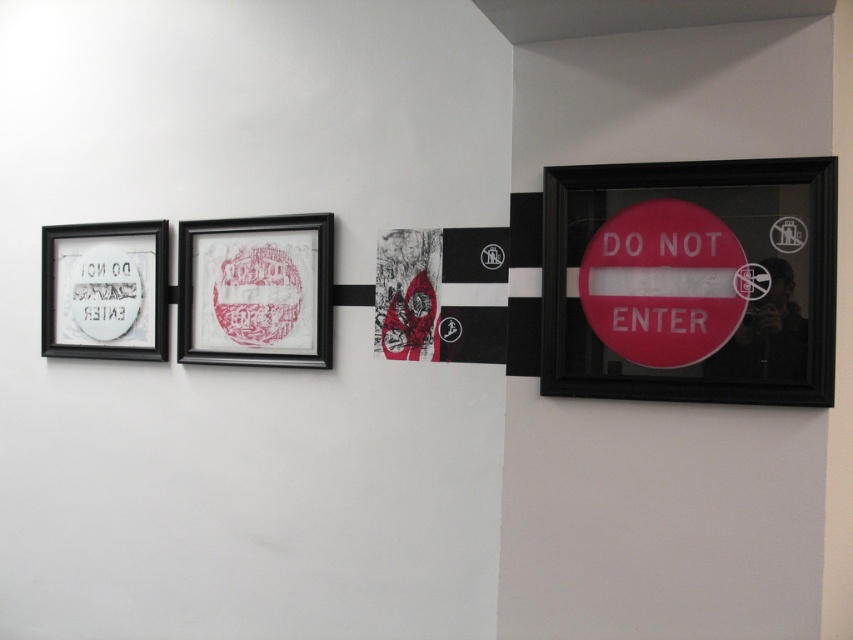
Question: Does matte paper picture frame at center have a greater width compared to red textured fabric at center?

Choices:
 (A) yes
 (B) no

Answer: (A)

Question: Among these points, which one is farthest from the camera?

Choices:
 (A) (204, 355)
 (B) (601, 317)

Answer: (A)

Question: Among these objects, which one is farthest from the camera?

Choices:
 (A) red glossy sign at right
 (B) matte plastic sign at right

Answer: (A)

Question: Does matte plastic sign at right have a lesser width compared to red textured fabric at center?

Choices:
 (A) no
 (B) yes

Answer: (A)

Question: Is matte paper picture frame at center positioned before matte black sign at left?

Choices:
 (A) yes
 (B) no

Answer: (A)

Question: Which of the following is the farthest from the observer?

Choices:
 (A) (395, 292)
 (B) (207, 262)
 (C) (135, 273)

Answer: (C)